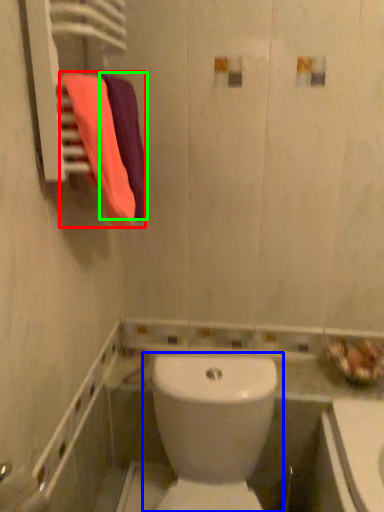
Question: Which is farther away from bath towel (highlighted by a red box)? toilet (highlighted by a blue box) or bath towel (highlighted by a green box)?

Choices:
 (A) toilet
 (B) bath towel

Answer: (A)